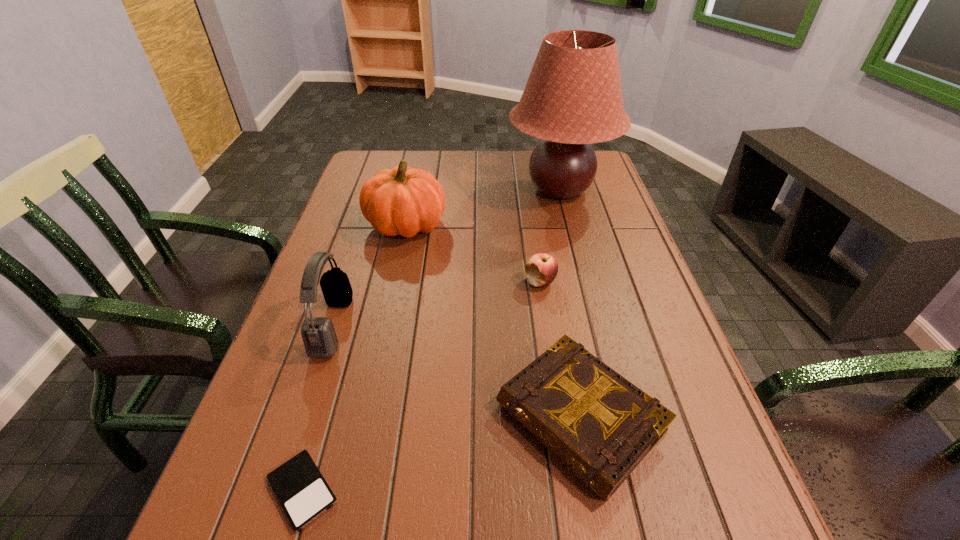
The image size is (960, 540). I want to click on the tallest object, so click(573, 98).

In order to click on pumpkin in this screenshot , I will do `click(403, 201)`.

Identify the location of headset. (319, 337).

Locate an element on the screen. The height and width of the screenshot is (540, 960). the third shortest object is located at coordinates (541, 269).

Where is `the fourth nearest object`? The image size is (960, 540). the fourth nearest object is located at coordinates (541, 269).

The width and height of the screenshot is (960, 540). I want to click on hardback book, so click(601, 426).

The width and height of the screenshot is (960, 540). I want to click on iPod, so click(301, 489).

The width and height of the screenshot is (960, 540). I want to click on vacant space located on the front-facing side of the tallest object, so click(584, 286).

The height and width of the screenshot is (540, 960). Identify the location of vacant space located on the right of the pumpkin. (564, 225).

You are a GUI agent. You are given a task and a screenshot of the screen. Output one action in this format:
    pyautogui.click(x=<x>, y=<y>)
    Task: Click on the vacant space situated 0.120m on the headband of the headset
    
    Given the screenshot: What is the action you would take?
    pyautogui.click(x=401, y=326)